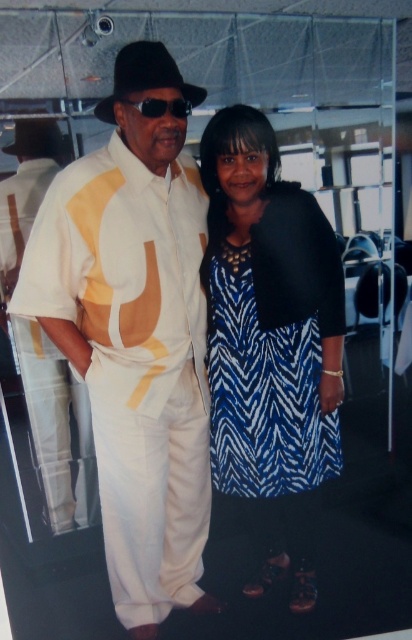
Is point (234, 305) closer to camera compared to point (161, 106)?

No.

The image size is (412, 640). Describe the element at coordinates (262, 390) in the screenshot. I see `blue zebra-patterned dress at center` at that location.

Locate an element on the screen. The width and height of the screenshot is (412, 640). blue zebra-patterned dress at center is located at coordinates (262, 390).

Between blue zebra-pattern dress at center and sunglasses at center, which one is positioned lower?

Positioned lower is blue zebra-pattern dress at center.

The width and height of the screenshot is (412, 640). Describe the element at coordinates (269, 342) in the screenshot. I see `blue zebra-pattern dress at center` at that location.

The height and width of the screenshot is (640, 412). Identify the location of blue zebra-pattern dress at center. (269, 342).

Find the location of a particular element. This screenshot has width=412, height=640. blue zebra-pattern dress at center is located at coordinates (269, 342).

Consider the image. Can you confirm if blue zebra-pattern dress at center is bigger than blue zebra-patterned dress at center?

Indeed, blue zebra-pattern dress at center has a larger size compared to blue zebra-patterned dress at center.

Is point (260, 452) positioned in front of point (294, 333)?

No, (260, 452) is further to viewer.

This screenshot has height=640, width=412. In order to click on blue zebra-pattern dress at center in this screenshot , I will do `click(269, 342)`.